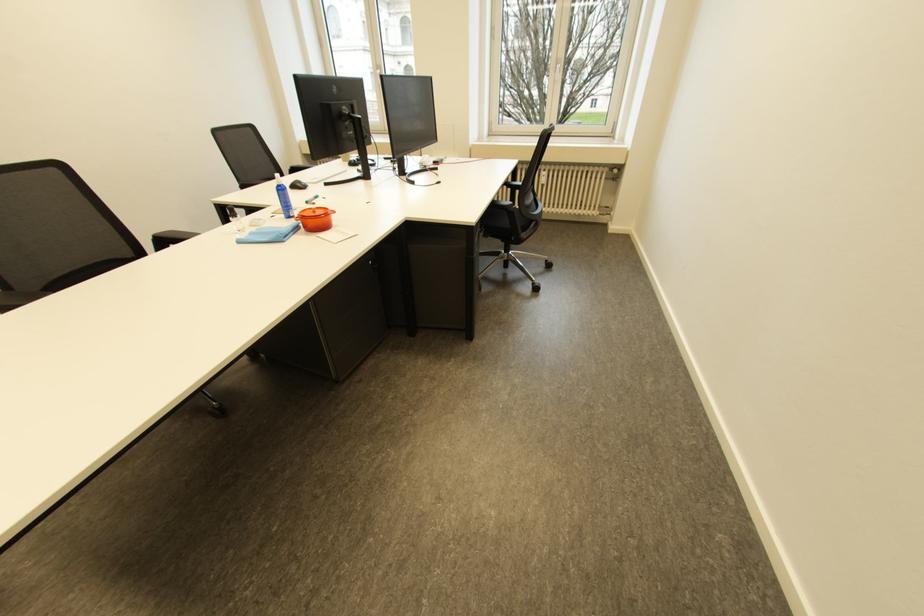
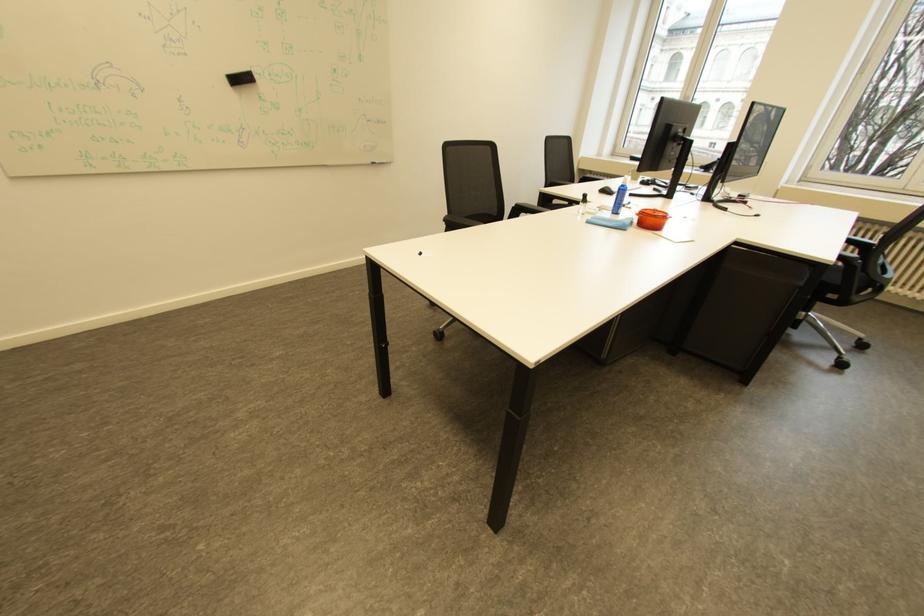
Where in the second image is the point corresponding to the point at 323,213 from the first image?

(664, 213)